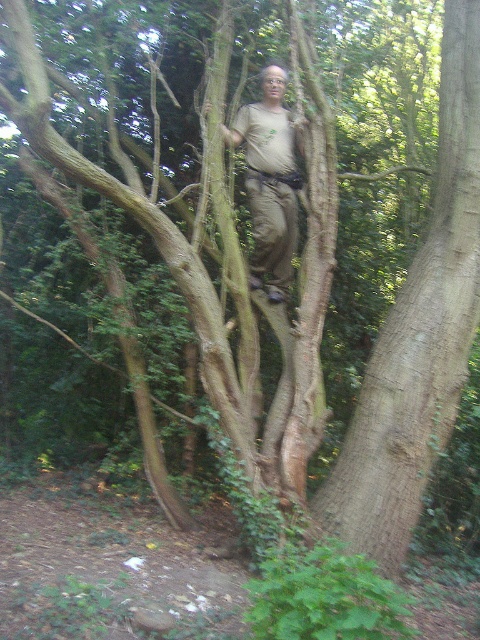
Who is lower down, brown rough tree trunk at center or light brown fabric shirt at center?

brown rough tree trunk at center is below.

Is brown rough tree trunk at center further to camera compared to light brown fabric shirt at center?

No, it is not.

Image resolution: width=480 pixels, height=640 pixels. Describe the element at coordinates (418, 333) in the screenshot. I see `brown rough tree trunk at center` at that location.

Find the location of a particular element. brown rough tree trunk at center is located at coordinates (418, 333).